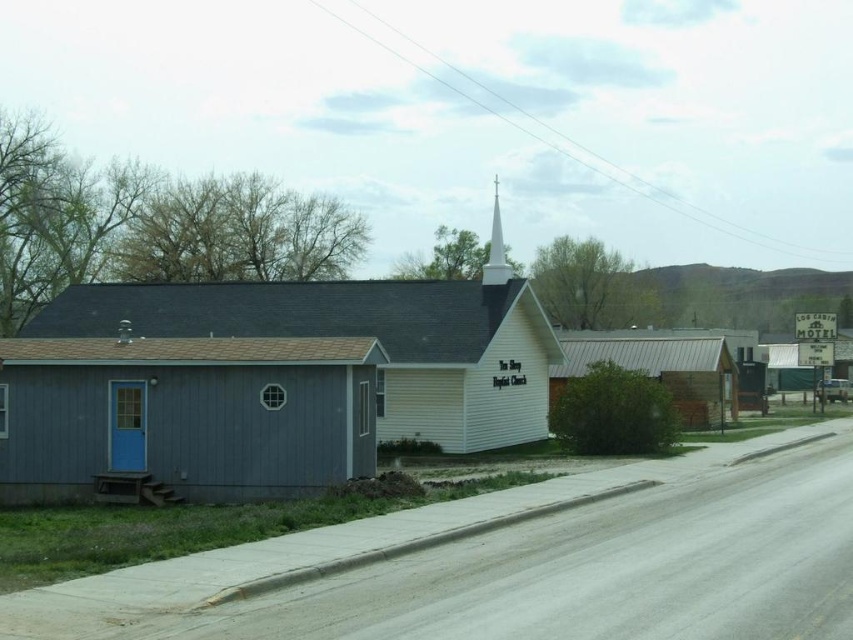
Question: Can you confirm if matte blue siding at center is smaller than brown wood cabin at center?

Choices:
 (A) no
 (B) yes

Answer: (B)

Question: Does matte blue cabin at left have a smaller size compared to white smooth steeple at upper center?

Choices:
 (A) no
 (B) yes

Answer: (B)

Question: Which object is farther from the camera taking this photo?

Choices:
 (A) brown wood cabin at center
 (B) matte blue cabin at left
 (C) white smooth steeple at upper center
 (D) matte blue siding at center

Answer: (C)

Question: Which object appears closest to the camera in this image?

Choices:
 (A) white smooth steeple at upper center
 (B) matte blue cabin at left

Answer: (B)

Question: Which object is the farthest from the brown wood cabin at center?

Choices:
 (A) matte blue cabin at left
 (B) white smooth steeple at upper center

Answer: (A)

Question: Is matte blue cabin at left behind brown wood cabin at center?

Choices:
 (A) no
 (B) yes

Answer: (A)